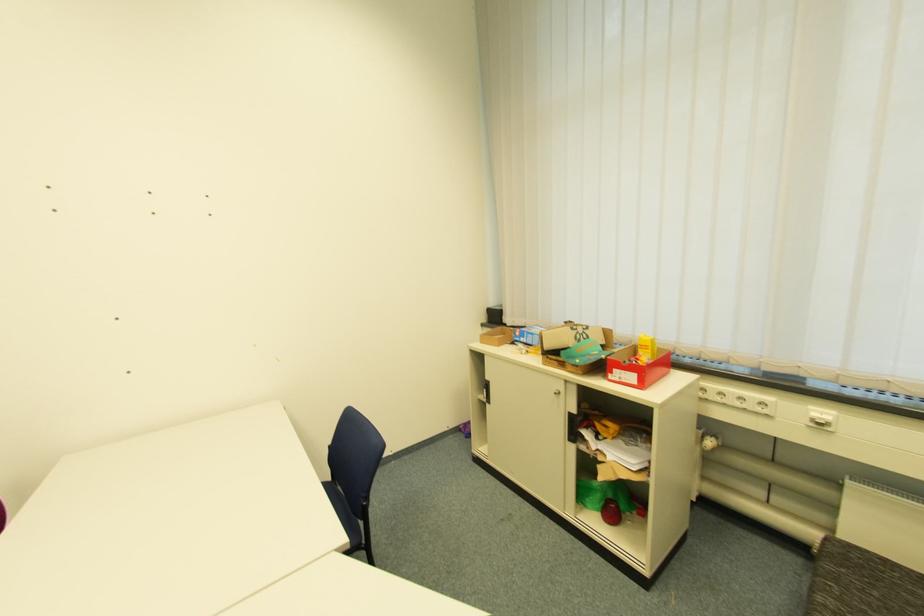
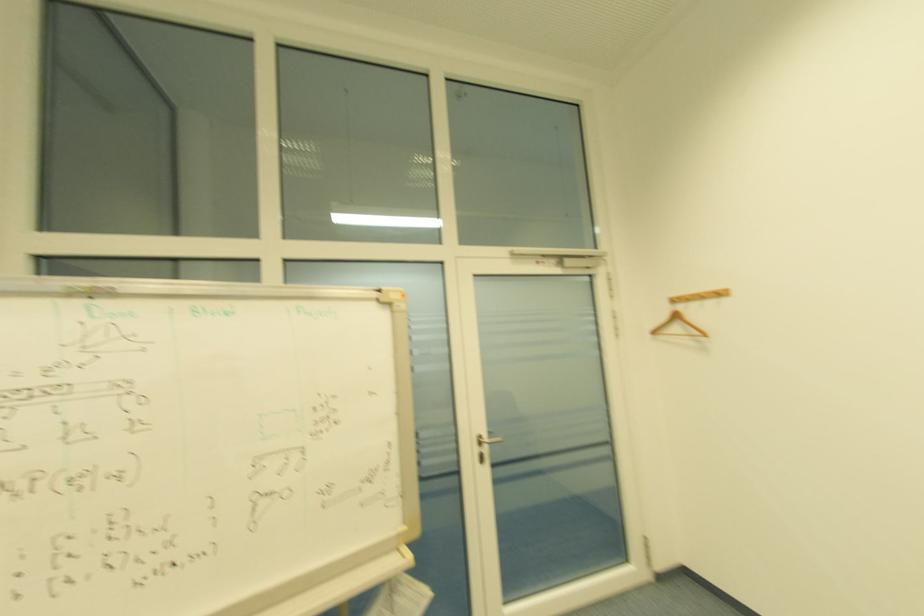
Question: The camera is either moving clockwise (left) or counter-clockwise (right) around the object. The first image is from the beginning of the video and the second image is from the end. Is the camera moving left or right when shooting the video?

Choices:
 (A) Left
 (B) Right

Answer: (B)